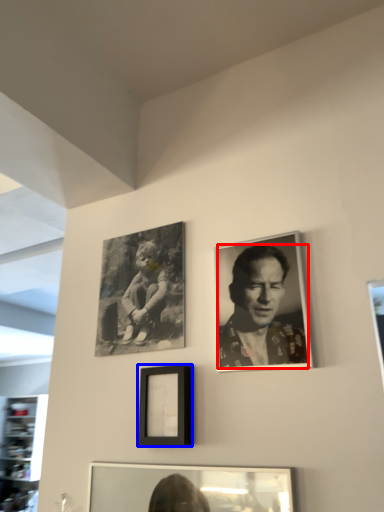
Question: Which object is further to the camera taking this photo, man (highlighted by a red box) or picture frame (highlighted by a blue box)?

Choices:
 (A) man
 (B) picture frame

Answer: (B)